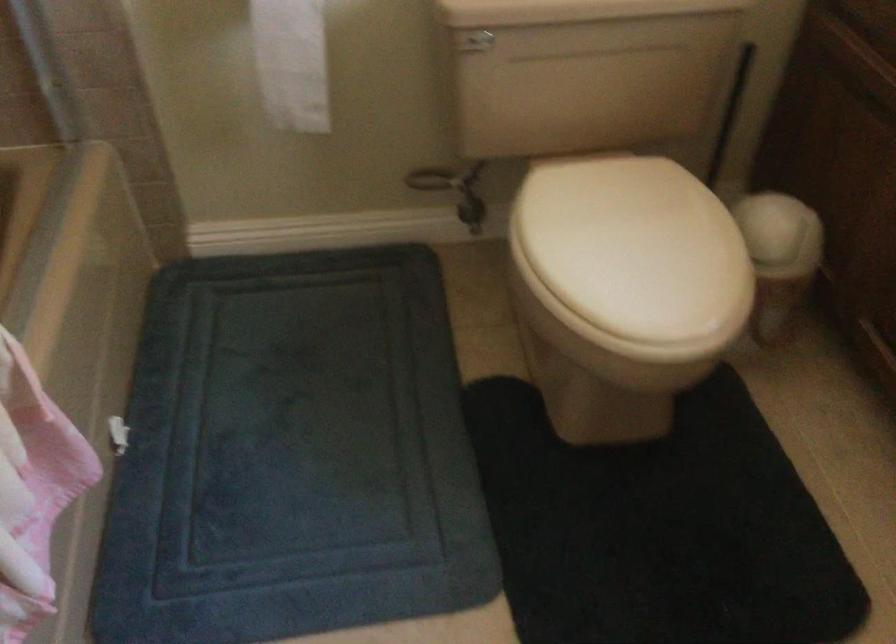
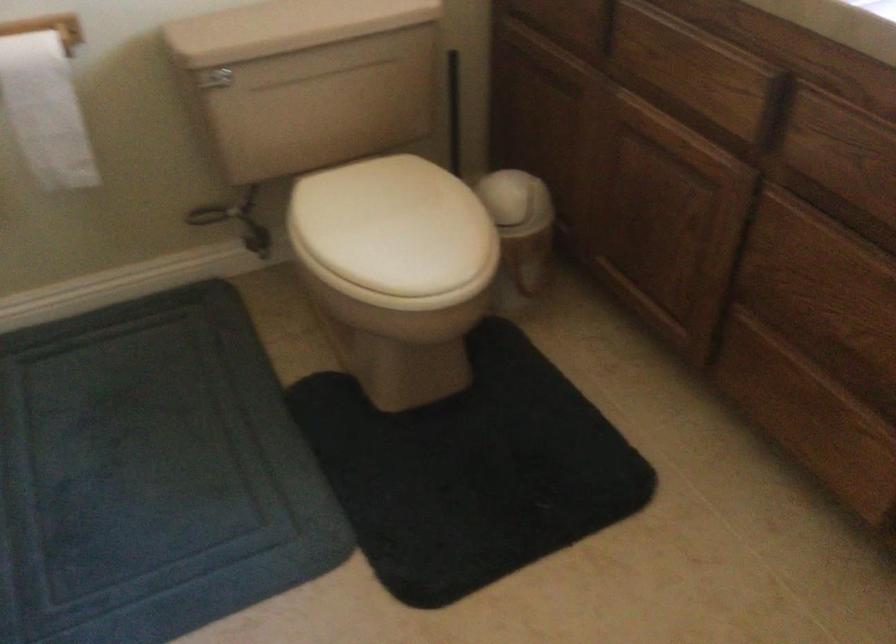
Question: The images are taken continuously from a first-person perspective. In which direction are you moving?

Choices:
 (A) Left
 (B) Right
 (C) Forward
 (D) Backward

Answer: (D)